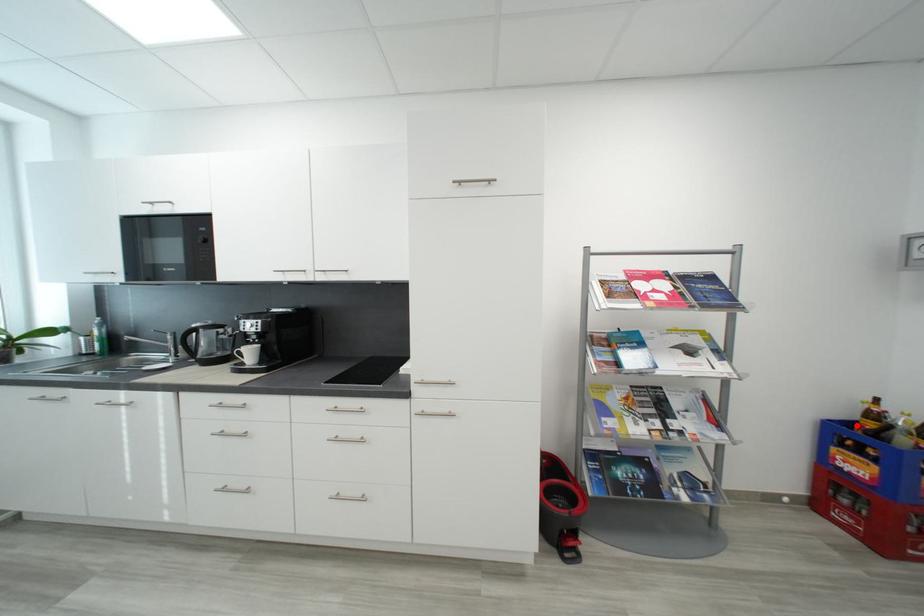
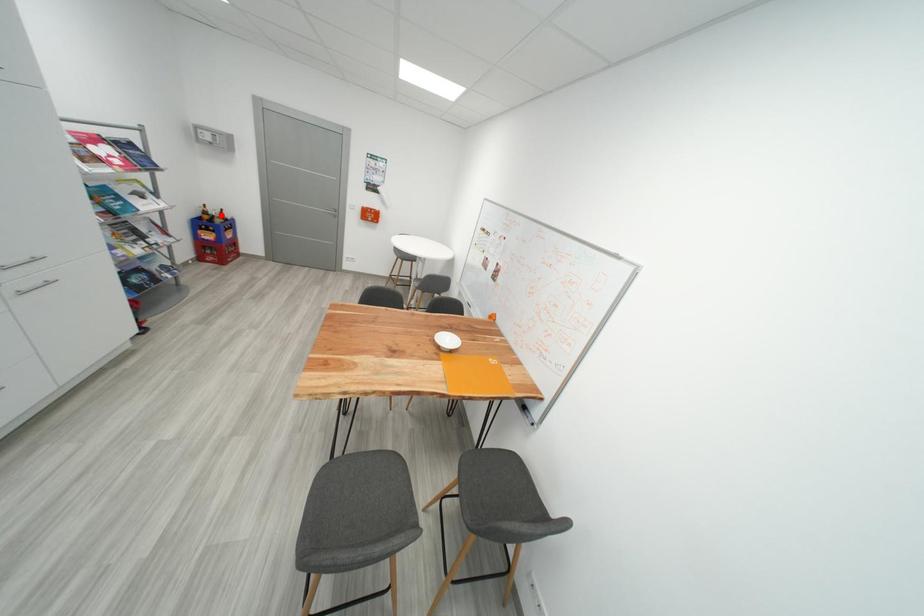
I am providing you with two images of the same scene from different viewpoints. A red point is marked on the first image and another point is marked on the second image. Are the points marked in image1 and image2 representing the same 3D position?

No